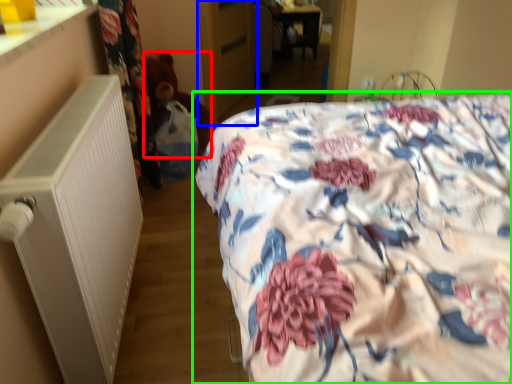
Question: Based on their relative distances, which object is farther from teddy (highlighted by a red box)? Choose from armoire (highlighted by a blue box) and bed (highlighted by a green box).

Choices:
 (A) armoire
 (B) bed

Answer: (B)